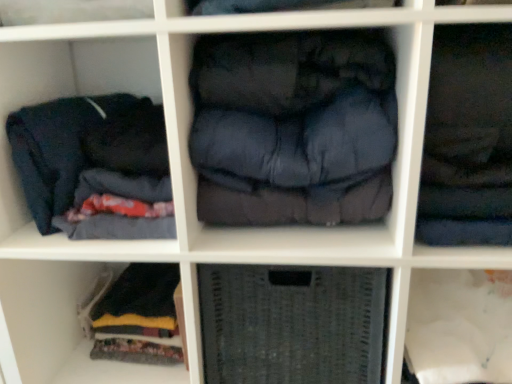
Question: Considering the relative positions of dark blue fabric at upper right, which is counted as the third clothing, starting from the left, and dark blue quilted jacket at center, the second clothing viewed from the right, in the image provided, is dark blue fabric at upper right, which is counted as the third clothing, starting from the left, behind dark blue quilted jacket at center, the second clothing viewed from the right,?

Choices:
 (A) yes
 (B) no

Answer: (B)

Question: From the image's perspective, is dark blue fabric at upper right, the first clothing from the right, located above dark blue quilted jacket at center, which is counted as the second clothing, starting from the left?

Choices:
 (A) no
 (B) yes

Answer: (B)

Question: Could you tell me if dark blue fabric at upper right, which is counted as the third clothing, starting from the left, is facing dark blue quilted jacket at center, which is counted as the second clothing, starting from the left?

Choices:
 (A) no
 (B) yes

Answer: (A)

Question: Is dark blue fabric at upper right, which is counted as the third clothing, starting from the left, not near dark blue quilted jacket at center, which is counted as the second clothing, starting from the left?

Choices:
 (A) no
 (B) yes

Answer: (A)

Question: From the image's perspective, does dark blue fabric at upper right, the first clothing from the right, appear lower than dark blue quilted jacket at center, the second clothing viewed from the right?

Choices:
 (A) yes
 (B) no

Answer: (B)

Question: Considering the positions of point (265, 289) and point (300, 185), is point (265, 289) closer or farther from the camera than point (300, 185)?

Choices:
 (A) closer
 (B) farther

Answer: (B)

Question: From the image's perspective, is gray woven basket at center positioned above or below dark blue quilted jacket at center, which is counted as the second clothing, starting from the left?

Choices:
 (A) above
 (B) below

Answer: (B)

Question: From a real-world perspective, relative to dark blue quilted jacket at center, the second clothing viewed from the right, is gray woven basket at center vertically above or below?

Choices:
 (A) above
 (B) below

Answer: (B)

Question: Which is correct: gray woven basket at center is inside dark blue quilted jacket at center, the second clothing viewed from the right, or outside of it?

Choices:
 (A) inside
 (B) outside

Answer: (B)

Question: Considering their positions, is dark blue fabric at left, which is the 1th clothing in left-to-right order, located in front of or behind dark blue fabric at upper right, the first clothing from the right?

Choices:
 (A) front
 (B) behind

Answer: (B)

Question: Is point (66, 148) positioned closer to the camera than point (437, 49)?

Choices:
 (A) farther
 (B) closer

Answer: (A)

Question: Would you say dark blue fabric at left, the 3th clothing in the right-to-left sequence, is inside or outside dark blue fabric at upper right, the first clothing from the right?

Choices:
 (A) inside
 (B) outside

Answer: (B)

Question: In terms of height, does dark blue fabric at left, which is the 1th clothing in left-to-right order, look taller or shorter compared to dark blue fabric at upper right, which is counted as the third clothing, starting from the left?

Choices:
 (A) tall
 (B) short

Answer: (B)

Question: Is point (272, 122) closer or farther from the camera than point (457, 172)?

Choices:
 (A) farther
 (B) closer

Answer: (A)

Question: Is dark blue quilted jacket at center, which is counted as the second clothing, starting from the left, inside or outside of dark blue fabric at upper right, which is counted as the third clothing, starting from the left?

Choices:
 (A) inside
 (B) outside

Answer: (B)